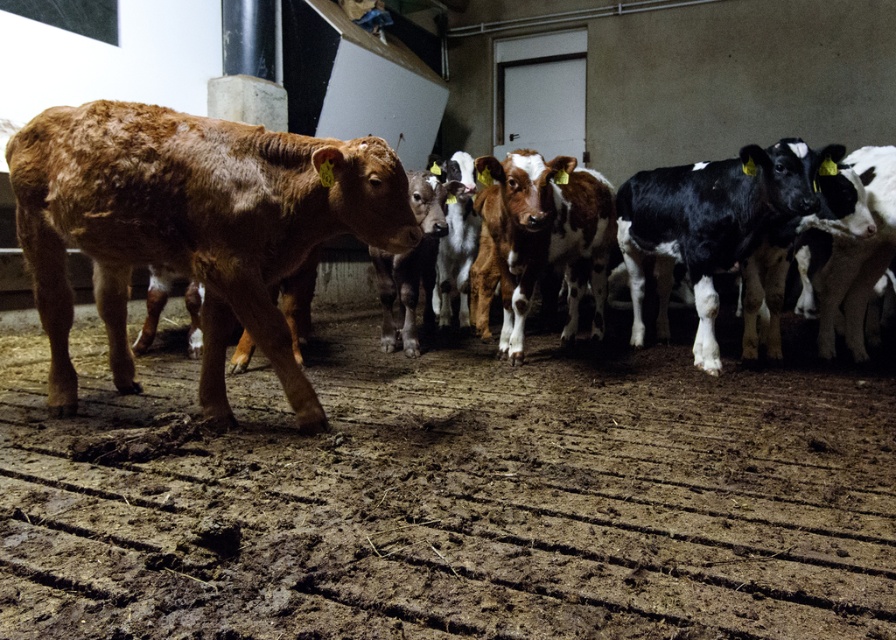
Does brown textured dirt track at center have a lesser width compared to brown furry calf at left?

Incorrect, brown textured dirt track at center's width is not less than brown furry calf at left's.

Is brown textured dirt track at center positioned at the back of brown furry calf at left?

That is False.

Image resolution: width=896 pixels, height=640 pixels. Identify the location of brown textured dirt track at center. (446, 497).

Does point (191, 120) lie in front of point (149, 125)?

No, (191, 120) is behind (149, 125).

Can you confirm if brown smooth calf at left is thinner than brown furry calf at left?

Correct, brown smooth calf at left's width is less than brown furry calf at left's.

Image resolution: width=896 pixels, height=640 pixels. Describe the element at coordinates (191, 225) in the screenshot. I see `brown smooth calf at left` at that location.

Locate an element on the screen. This screenshot has height=640, width=896. brown smooth calf at left is located at coordinates (191, 225).

Which is in front, point (141, 636) or point (368, 212)?

Point (141, 636) is in front.

Is brown textured dirt track at center taller than brown smooth calf at left?

In fact, brown textured dirt track at center may be shorter than brown smooth calf at left.

Is point (737, 628) in front of point (257, 188)?

Yes, point (737, 628) is in front of point (257, 188).

Locate an element on the screen. This screenshot has width=896, height=640. brown textured dirt track at center is located at coordinates (446, 497).